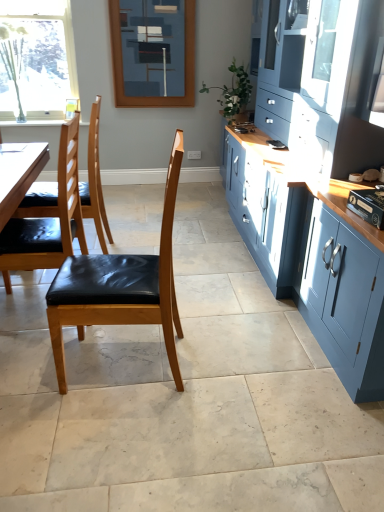
Locate an element on the screen. free space to the left of matte wood chair at left, which is the third chair from back to front is located at coordinates (37, 373).